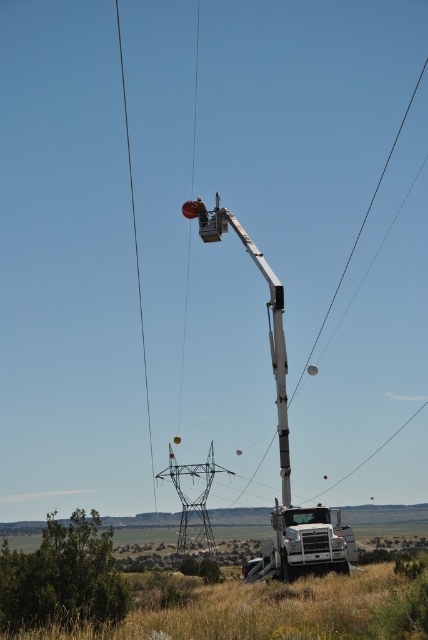
Question: Estimate the real-world distances between objects in this image. Which object is closer to the matte white trailer truck at lower right?

Choices:
 (A) metallic gray tower at center
 (B) dry grass at lower right
 (C) white metallic crane at center

Answer: (C)

Question: Is dry grass at lower right positioned behind metallic gray tower at center?

Choices:
 (A) no
 (B) yes

Answer: (A)

Question: Does dry grass at lower right appear on the right side of metallic gray tower at center?

Choices:
 (A) yes
 (B) no

Answer: (A)

Question: Which of the following is the closest to the observer?

Choices:
 (A) (241, 241)
 (B) (326, 602)
 (C) (327, 547)

Answer: (B)

Question: In this image, where is matte white trailer truck at lower right located relative to white metallic crane at center?

Choices:
 (A) below
 (B) above

Answer: (A)

Question: Which of the following is the closest to the observer?

Choices:
 (A) matte white trailer truck at lower right
 (B) white metallic crane at center
 (C) metallic gray tower at center
 (D) dry grass at lower right

Answer: (D)